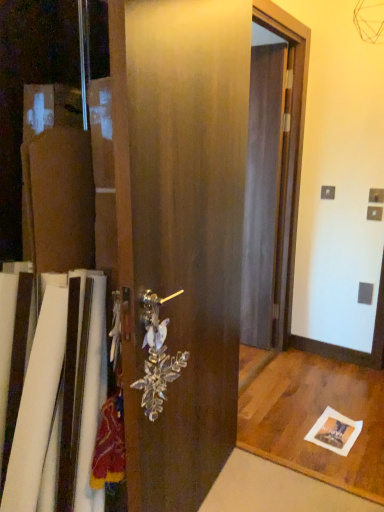
Identify the location of satin wood barn door at center. (184, 233).

In order to face satin wood barn door at center, should I rotate leftwards or rightwards?

To align with it, rotate right about 0.092°.

The width and height of the screenshot is (384, 512). Describe the element at coordinates (263, 188) in the screenshot. I see `transparent plastic screen door at center` at that location.

In the scene shown: Measure the distance between clear crystal door handle at center and camera.

The depth of clear crystal door handle at center is 3.65 feet.

You are a GUI agent. You are given a task and a screenshot of the screen. Output one action in this format:
    pyautogui.click(x=<x>, y=<y>)
    Task: Click on the satin wood barn door at center
    
    Given the screenshot: What is the action you would take?
    pyautogui.click(x=184, y=233)

Is satin wood barn door at center surrounding transparent plastic screen door at center?

No, transparent plastic screen door at center is not inside satin wood barn door at center.

From the image's perspective, which one is positioned higher, satin wood barn door at center or transparent plastic screen door at center?

transparent plastic screen door at center, from the image's perspective.

Is satin wood barn door at center far away from transparent plastic screen door at center?

That's right, there is a large distance between satin wood barn door at center and transparent plastic screen door at center.

Is point (205, 112) positioned after point (277, 100)?

That is False.

Considering the points (152, 383) and (162, 447), which point is in front, point (152, 383) or point (162, 447)?

The point (152, 383) is closer to the camera.

Is clear crystal door handle at center turned away from satin wood barn door at center?

That's right, clear crystal door handle at center is facing away from satin wood barn door at center.

Find the location of a particular element. The height and width of the screenshot is (512, 384). door handle below the satin wood barn door at center (from a real-world perspective) is located at coordinates [157, 356].

Is clear crystal door handle at center beside satin wood barn door at center?

clear crystal door handle at center and satin wood barn door at center are not in contact.

Based on the photo, between clear crystal door handle at center and transparent plastic screen door at center, which one has smaller width?

Thinner between the two is clear crystal door handle at center.

Looking at this image, can we say clear crystal door handle at center lies outside transparent plastic screen door at center?

That's correct, clear crystal door handle at center is outside of transparent plastic screen door at center.

Consider the image. Is clear crystal door handle at center far from transparent plastic screen door at center?

clear crystal door handle at center is far away from transparent plastic screen door at center.

Which of these two, clear crystal door handle at center or transparent plastic screen door at center, stands shorter?

clear crystal door handle at center is shorter.

From a real-world perspective, which is physically above, transparent plastic screen door at center or clear crystal door handle at center?

From a 3D spatial view, transparent plastic screen door at center is above.

Which object is closer to the camera, transparent plastic screen door at center or clear crystal door handle at center?

clear crystal door handle at center is more forward.

Between transparent plastic screen door at center and clear crystal door handle at center, which one has larger size?

Bigger between the two is transparent plastic screen door at center.

Is transparent plastic screen door at center not within clear crystal door handle at center?

Indeed, transparent plastic screen door at center is completely outside clear crystal door handle at center.

In the scene shown: Which is more to the right, satin wood barn door at center or clear crystal door handle at center?

satin wood barn door at center.

Considering the relative sizes of satin wood barn door at center and clear crystal door handle at center in the image provided, is satin wood barn door at center bigger than clear crystal door handle at center?

Indeed, satin wood barn door at center has a larger size compared to clear crystal door handle at center.

Considering the sizes of objects satin wood barn door at center and clear crystal door handle at center in the image provided, who is thinner, satin wood barn door at center or clear crystal door handle at center?

clear crystal door handle at center is thinner.

Is transparent plastic screen door at center further to the viewer compared to satin wood barn door at center?

That is True.

Find the location of a particular element. The width and height of the screenshot is (384, 512). screen door above the satin wood barn door at center (from the image's perspective) is located at coordinates (263, 188).

Can you confirm if transparent plastic screen door at center is wider than satin wood barn door at center?

In fact, transparent plastic screen door at center might be narrower than satin wood barn door at center.

Which object is positioned more to the right, transparent plastic screen door at center or satin wood barn door at center?

transparent plastic screen door at center.

I want to click on screen door on the right of the satin wood barn door at center, so click(263, 188).

The width and height of the screenshot is (384, 512). In order to click on barn door above the clear crystal door handle at center (from the image's perspective) in this screenshot , I will do `click(184, 233)`.

Considering their positions, is clear crystal door handle at center positioned closer to satin wood barn door at center than transparent plastic screen door at center?

clear crystal door handle at center.

Considering their positions, is transparent plastic screen door at center positioned closer to satin wood barn door at center than clear crystal door handle at center?

Based on the image, clear crystal door handle at center appears to be nearer to satin wood barn door at center.

Looking at the image, which one is located further to transparent plastic screen door at center, clear crystal door handle at center or satin wood barn door at center?

clear crystal door handle at center.

From the image, which object appears to be farther from clear crystal door handle at center, transparent plastic screen door at center or satin wood barn door at center?

The object further to clear crystal door handle at center is transparent plastic screen door at center.

From the image, which object appears to be farther from clear crystal door handle at center, satin wood barn door at center or transparent plastic screen door at center?

The object further to clear crystal door handle at center is transparent plastic screen door at center.

When comparing their distances from transparent plastic screen door at center, does satin wood barn door at center or clear crystal door handle at center seem closer?

satin wood barn door at center lies closer to transparent plastic screen door at center than the other object.

Locate an element on the screen. The image size is (384, 512). door handle between satin wood barn door at center and transparent plastic screen door at center from front to back is located at coordinates (157, 356).